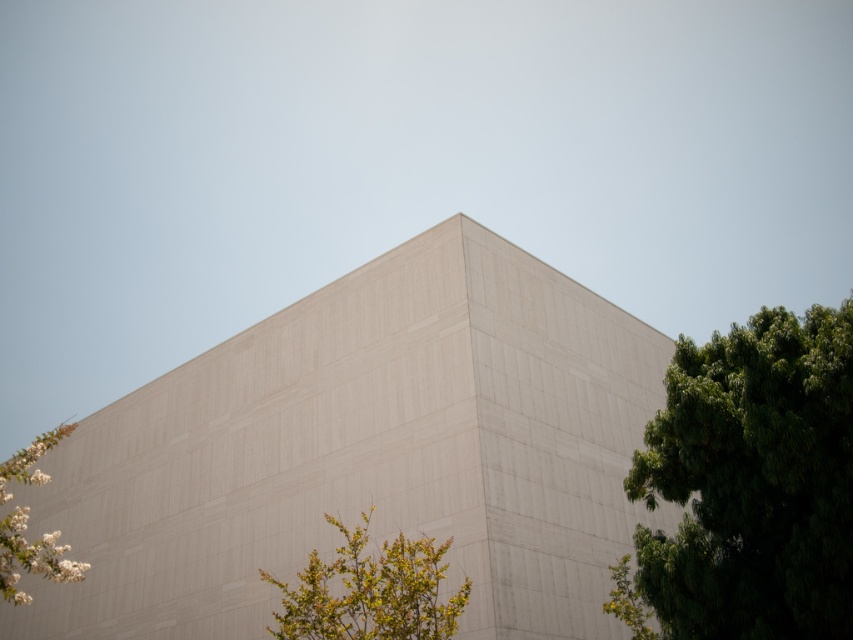
Question: In this image, where is green leafy bush at lower center located relative to white textured flowers at lower left?

Choices:
 (A) right
 (B) left

Answer: (A)

Question: Which of the following is the closest to the observer?

Choices:
 (A) green leafy bush at lower center
 (B) green leafy tree at right
 (C) white textured flowers at lower left

Answer: (B)

Question: Estimate the real-world distances between objects in this image. Which object is closer to the white textured flowers at lower left?

Choices:
 (A) green leafy tree at right
 (B) green leafy bush at lower center

Answer: (B)

Question: Does green leafy tree at right appear on the left side of green leafy bush at lower center?

Choices:
 (A) yes
 (B) no

Answer: (B)

Question: Is green leafy tree at right to the right of white textured flowers at lower left from the viewer's perspective?

Choices:
 (A) yes
 (B) no

Answer: (A)

Question: Among these points, which one is farthest from the camera?

Choices:
 (A) (677, 486)
 (B) (361, 584)
 (C) (12, 593)

Answer: (C)